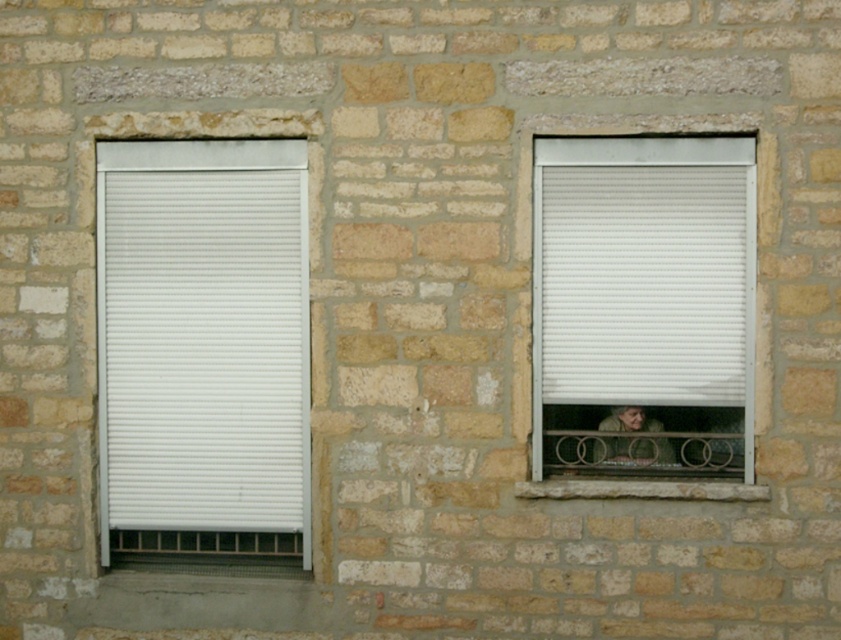
You are standing in front of the building and notice the white plastic window at right. Can you determine if this window is open or closed based on its position compared to the other window?

The white plastic window at right is partially open at the bottom, so it is open.

You are a window cleaner standing on a ladder outside the building. You need to clean both the white matte blind at left and the light brown leather jacket at lower right. The ladder can only reach objects within 3 feet of each other. Can you clean both without moving the ladder?

The white matte blind at left is 3.51 feet from the light brown leather jacket at lower right. Since the ladder can only reach objects within 3 feet, you cannot clean both without moving the ladder because the distance exceeds the ladder reach.

You are standing in front of the building wall and want to determine the order of two points marked on the wall. Which point is closer to you, point at coordinate [743,177] or point at coordinate [594,442]?

Point at coordinate [743,177] is in front of point at coordinate [594,442], so it is closer to you.